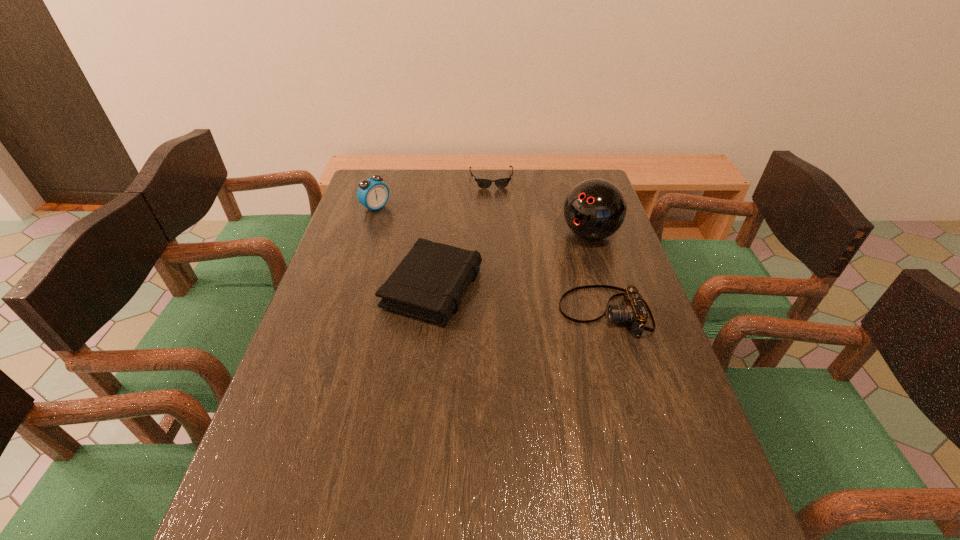
Locate an element on the screen. free space between the camera and the fourth shortest object is located at coordinates (491, 260).

What are the coordinates of `free spot between the camera and the farthest object` in the screenshot? It's located at (548, 246).

I want to click on blank region between the leftmost object and the sunglasses, so click(434, 193).

At what (x,y) coordinates should I click in order to perform the action: click on the closest object to the bowling ball. Please return your answer as a coordinate pair (x, y). Image resolution: width=960 pixels, height=540 pixels. Looking at the image, I should click on (634, 311).

Locate which object is the closest to the camera. Please provide its 2D coordinates. Your answer should be formatted as a tuple, i.e. [(x, y)], where the tuple contains the x and y coordinates of a point satisfying the conditions above.

[(594, 209)]

Locate an element on the screen. vacant region that satisfies the following two spatial constraints: 1. on the front side of the tallest object; 2. on the right side of the farthest object is located at coordinates (493, 234).

Identify the location of vacant region that satisfies the following two spatial constraints: 1. on the front side of the tallest object; 2. on the left side of the leftmost object. Image resolution: width=960 pixels, height=540 pixels. (368, 234).

At what (x,y) coordinates should I click in order to perform the action: click on free space that satisfies the following two spatial constraints: 1. on the back side of the farthest object; 2. on the left side of the Bible. Please return your answer as a coordinate pair (x, y). Looking at the image, I should click on (445, 179).